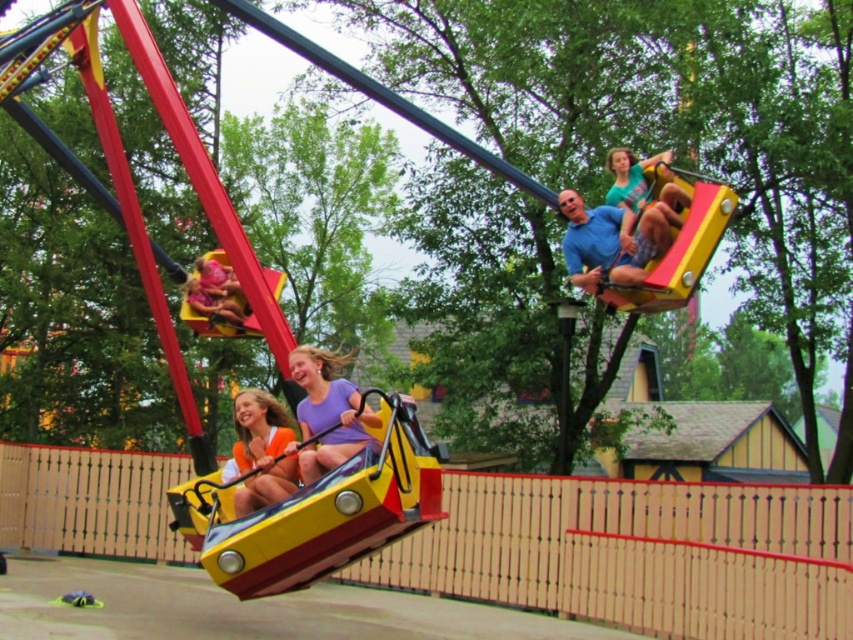
In the fairground scene, there are two specific items of clothing visible. The orange fabric at lower center and the matte green shirt at upper right. From the perspective of someone standing at the base of the swing ride, which clothing item is positioned to the left?

The orange fabric at lower center is to the left of the matte green shirt at upper right from the observer standing at the base of the swing ride.

You are standing at the entrance of the amusement park and see two points in the image. The first point is labeled as point (639, 177) and the second is point (657, 250). Which point is closer to you?

Point (639, 177) is closer to you because it is further to the viewer than point (657, 250).

You are standing at the point marked by the coordinates point (347, 433), and you want to take a photo of the swing ride. The camera you are using has a maximum focus range of 10 meters. Will the camera be able to focus on the swing ride?

The distance between you at point (347, 433) and the viewer is 11.13 meters, which exceeds the camera maximum focus range of 10 meters. Therefore, the camera will not be able to focus on the swing ride.